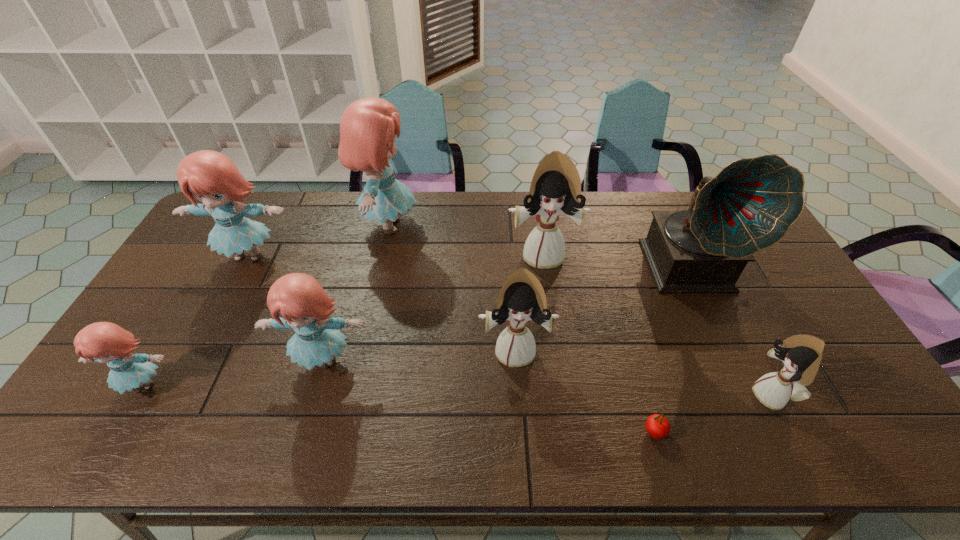
Where is `doll that stands as the sixth closest to the farthest black doll`? This screenshot has height=540, width=960. doll that stands as the sixth closest to the farthest black doll is located at coordinates (102, 342).

Identify which blue doll is the closest to the second farthest black doll. Please provide its 2D coordinates. Your answer should be formatted as a tuple, i.e. [(x, y)], where the tuple contains the x and y coordinates of a point satisfying the conditions above.

[(304, 306)]

Choose which blue doll is the nearest neighbor to the nearest black doll. Please provide its 2D coordinates. Your answer should be formatted as a tuple, i.e. [(x, y)], where the tuple contains the x and y coordinates of a point satisfying the conditions above.

[(304, 306)]

Identify which black doll is the closest to the rightmost doll. Please provide its 2D coordinates. Your answer should be formatted as a tuple, i.e. [(x, y)], where the tuple contains the x and y coordinates of a point satisfying the conditions above.

[(522, 297)]

Locate an element on the screen. Image resolution: width=960 pixels, height=540 pixels. black doll that is the third closest to the biggest blue doll is located at coordinates (801, 354).

Identify the location of vacant position in the image that satisfies the following two spatial constraints: 1. on the front-facing side of the biggest blue doll; 2. on the front-facing side of the third smallest blue doll. The width and height of the screenshot is (960, 540). (382, 256).

Locate an element on the screen. This screenshot has width=960, height=540. vacant space that satisfies the following two spatial constraints: 1. at the front face of the cherry; 2. on the right side of the farthest black doll is located at coordinates (568, 432).

Locate an element on the screen. free spot that satisfies the following two spatial constraints: 1. on the front-facing side of the cherry; 2. on the left side of the tallest doll is located at coordinates pos(343,432).

Locate an element on the screen. This screenshot has width=960, height=540. vacant space that satisfies the following two spatial constraints: 1. on the front-facing side of the red cherry; 2. on the left side of the biggest blue doll is located at coordinates (343, 432).

This screenshot has width=960, height=540. In order to click on vacant area in the image that satisfies the following two spatial constraints: 1. on the front-facing side of the second smallest blue doll; 2. on the left side of the red cherry in this screenshot , I will do `click(302, 432)`.